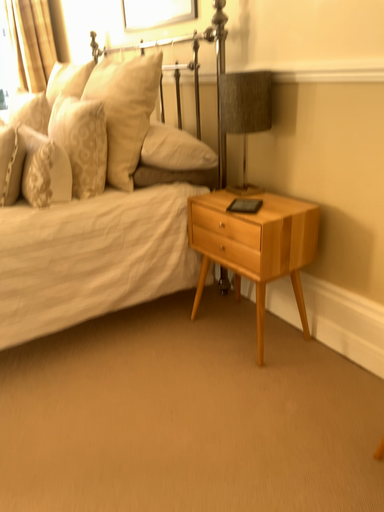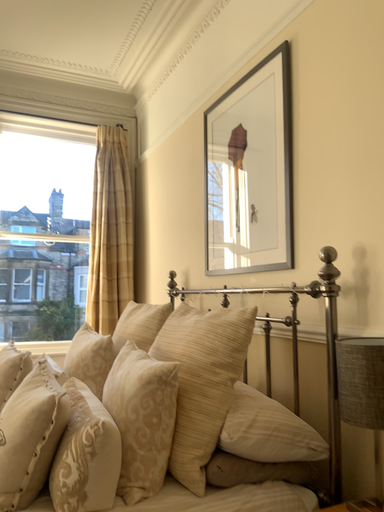
Question: How did the camera likely rotate when shooting the video?

Choices:
 (A) rotated right
 (B) rotated left

Answer: (B)